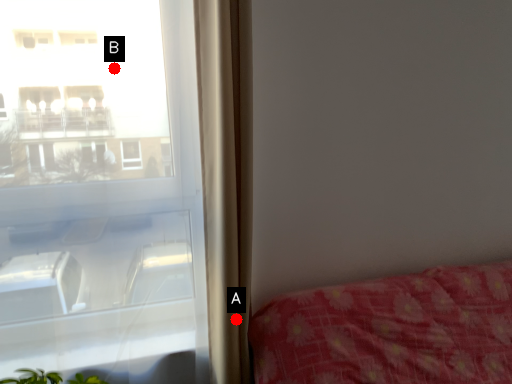
Question: Two points are circled on the image, labeled by A and B beside each circle. Which point is farther to the camera?

Choices:
 (A) A is further
 (B) B is further

Answer: (A)